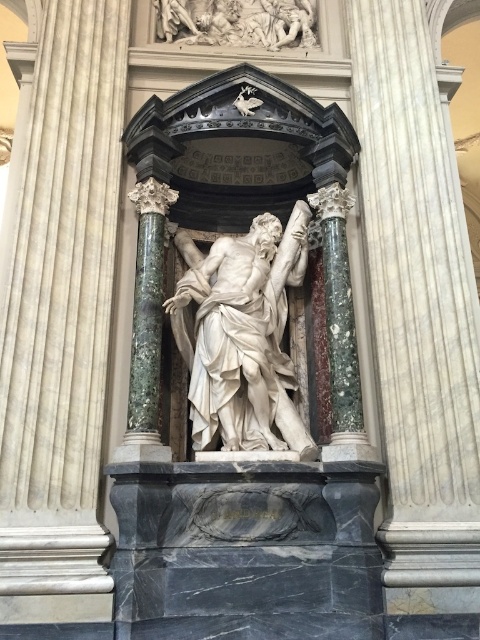
You are an art conservator assessing the visibility of the white marble statue at center in the niche. Given that the white marble column at center is in front of it, can you see the statue clearly from the front entrance of the niche?

The white marble statue at center is behind the white marble column at center, so the column blocks the direct view of the statue from the front entrance of the niche. Therefore, the statue cannot be seen clearly from that angle.

You are an art conservator assessing the placement of the white marble column at center and the white marble statue at center in the niche. Based on their heights, which object would require a taller base to ensure stability?

The white marble statue at center is taller than the white marble column at center, so it would require a taller base to ensure stability.